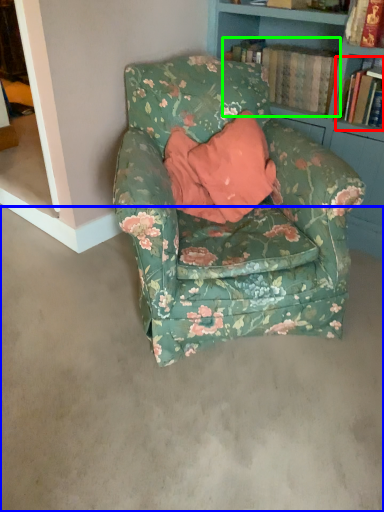
Question: Which object is positioned farthest from book (highlighted by a red box)? Select from concrete (highlighted by a blue box) and book (highlighted by a green box).

Choices:
 (A) concrete
 (B) book

Answer: (A)